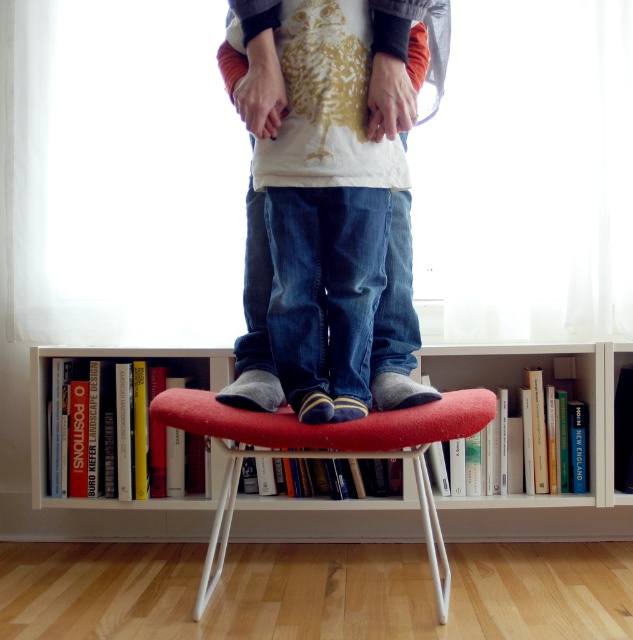
You are standing in the room and want to place a new book on the bookshelf. The book has a width of 15 cm. The point at coordinates (589, 444) is on the white wood bookcase at center. Can you determine if there is enough space at that point to place the book?

The point at coordinates (589, 444) is on the white wood bookcase at center, but the description does not provide information about the available space at that location. Therefore, it is impossible to determine if there is enough space to place the book.

You are a tailor measuring a customer for new jeans. The customer is standing on the red fabric stool at center while you examine the denim jeans at center. Which item is bigger in size?

The red fabric stool at center is larger in size than the denim jeans at center.

You are a delivery person holding a large package that requires placing on the white wood bookcase at center. The package is 2 meters long. Can you fit it on the bookcase?

The distance between you and the white wood bookcase at center is 1.93 meters. Since the package is 2 meters long, it is longer than the available space between you and the bookcase. Therefore, you cannot fit the package on the white wood bookcase at center.